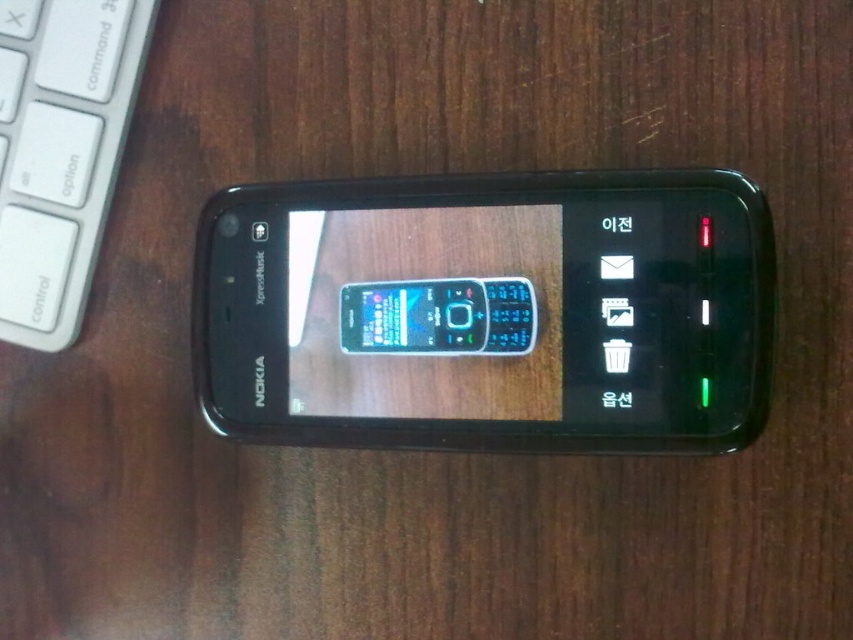
You are trying to place a book on the wooden surface next to the black glossy smartphone at center and the white plastic keyboard at upper left. Which object should you move to make space?

The black glossy smartphone at center has a lesser height compared to white plastic keyboard at upper left. Therefore, you should move the white plastic keyboard at upper left to make space since it is taller and might occupy more vertical space on the wooden surface.

You have a small toy car that is 10 cm long. You want to place it on the wooden surface next to the black glossy smartphone at center and the white plastic keyboard at upper left. Can the toy car fit horizontally between them without overlapping?

The black glossy smartphone at center is wider than the white plastic keyboard at upper left. Since the toy car is 10 cm long, it can fit horizontally between them if there is enough space. However, the exact distance between the objects isn

You are trying to locate the black glossy smartphone at center and the white plastic keyboard at upper left in the image. According to their positions, which object is closer to the right edge of the image?

The black glossy smartphone at center is closer to the right edge of the image because it is positioned to the right of the white plastic keyboard at upper left.